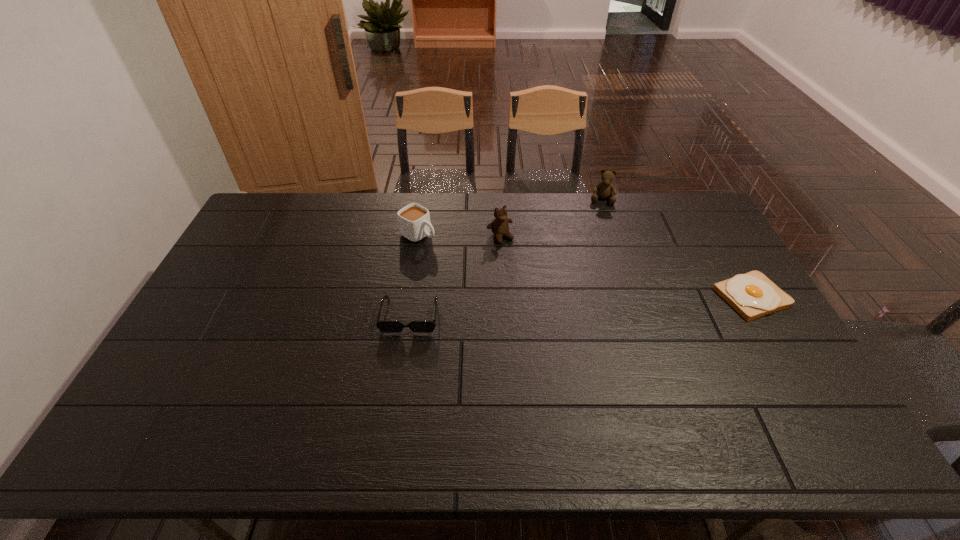
The height and width of the screenshot is (540, 960). What are the coordinates of `vacant space positioned at the face of the third object from right to left` in the screenshot? It's located at (530, 276).

This screenshot has width=960, height=540. Identify the location of blank space located 0.100m at the face of the third object from right to left. (519, 262).

This screenshot has width=960, height=540. Find the location of `free space located at the face of the third object from right to left`. free space located at the face of the third object from right to left is located at coordinates (561, 318).

Identify the location of vacant point located 0.270m on the front-facing side of the right teddy bear. (596, 253).

Locate an element on the screen. This screenshot has height=540, width=960. free space located 0.060m on the front-facing side of the right teddy bear is located at coordinates (600, 216).

The width and height of the screenshot is (960, 540). What are the coordinates of `free space located 0.300m on the front-facing side of the right teddy bear` in the screenshot? It's located at (595, 258).

At what (x,y) coordinates should I click in order to perform the action: click on vacant area located on the side with the handle of the third shortest object. Please return your answer as a coordinate pair (x, y). Image resolution: width=960 pixels, height=540 pixels. Looking at the image, I should click on (471, 264).

You are a GUI agent. You are given a task and a screenshot of the screen. Output one action in this format:
    pyautogui.click(x=<x>, y=<y>)
    Task: Click on the vacant position located 0.180m on the side with the handle of the third shortest object
    
    Given the screenshot: What is the action you would take?
    pyautogui.click(x=471, y=264)

The height and width of the screenshot is (540, 960). Identify the location of vacant space located 0.300m on the side with the handle of the third shortest object. (500, 281).

You are a GUI agent. You are given a task and a screenshot of the screen. Output one action in this format:
    pyautogui.click(x=<x>, y=<y>)
    Task: Click on the cup present at the far edge
    This screenshot has width=960, height=540.
    Given the screenshot: What is the action you would take?
    pyautogui.click(x=414, y=223)